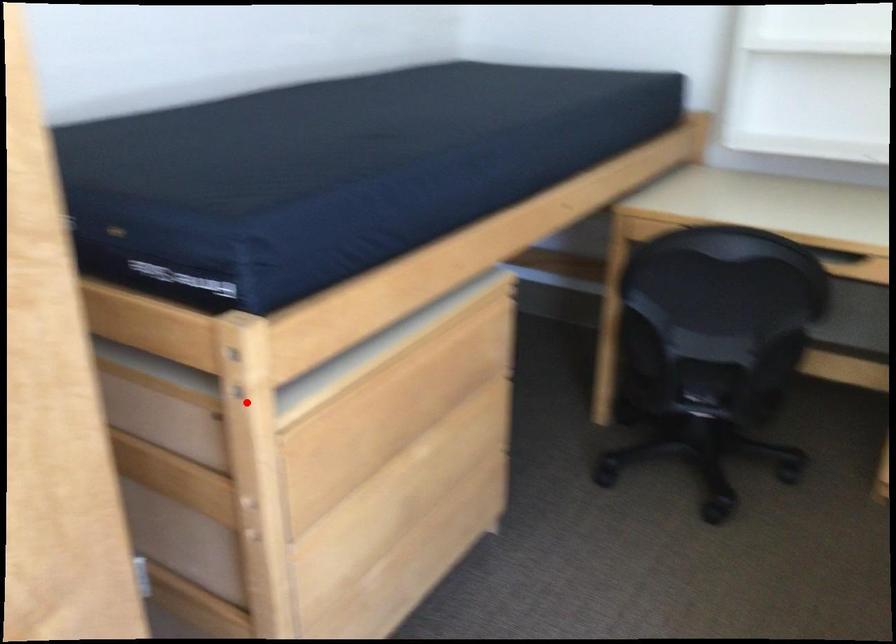
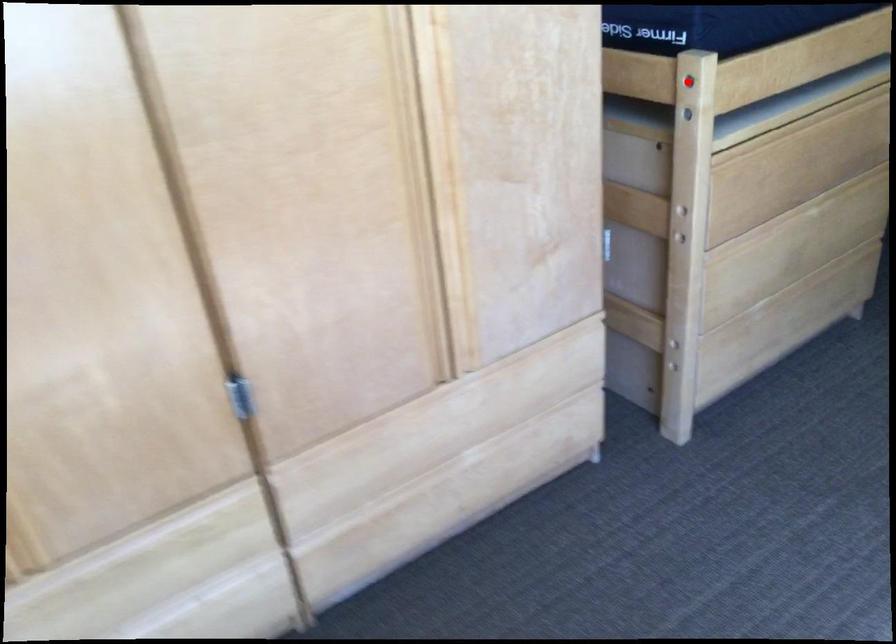
I am providing you with two images of the same scene from different viewpoints. A red point is marked on the first image and another point is marked on the second image. Is the red point in image1 aligned with the point shown in image2?

No